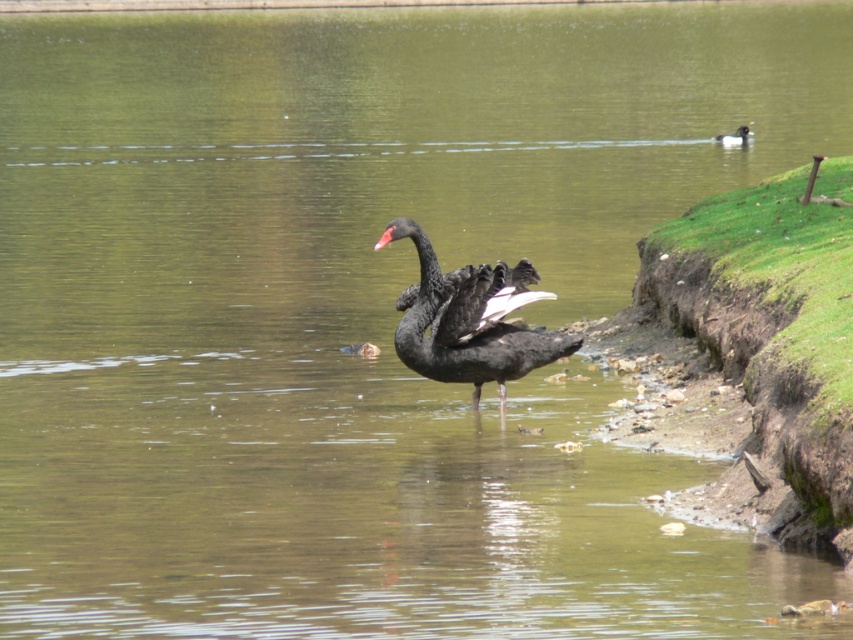
Question: Is matte black swan at center bigger than black matte beak at center?

Choices:
 (A) yes
 (B) no

Answer: (A)

Question: Does matte black swan at center appear under black matte beak at center?

Choices:
 (A) no
 (B) yes

Answer: (B)

Question: Is matte black swan at center closer to camera compared to black matte beak at center?

Choices:
 (A) yes
 (B) no

Answer: (B)